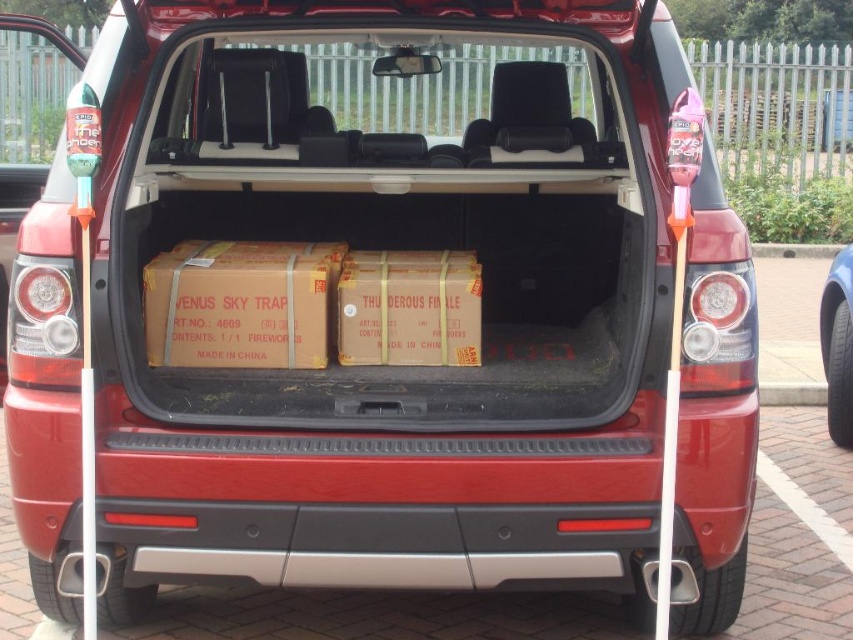
You are a delivery person who needs to place a new black rubber tire at lower right into the trunk of the red SUV. The trunk currently has a brown cardboard box at center. How far apart are these two items in the trunk?

The brown cardboard box at center is 3.50 meters away from the black rubber tire at lower right.

You are trying to load a new box into the trunk of the red SUV. The trunk has limited space, and you need to know where to place it. Which object at point coordinates (242, 305) is located in the trunk?

The brown cardboard box at center is located at point coordinates (242, 305) in the trunk.

You are standing behind the red SUV with its trunk open. You see two points marked inside the trunk. The first point is at position point (260,316) and the second point is at position point (828,308). From your perspective, which point is closer to you?

Point (260,316) is in front of point (828,308), so it is closer to you.